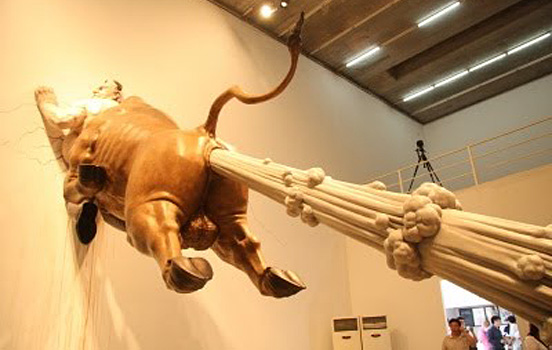
Find the location of a particular element. This screenshot has height=350, width=552. doorway is located at coordinates (450, 297).